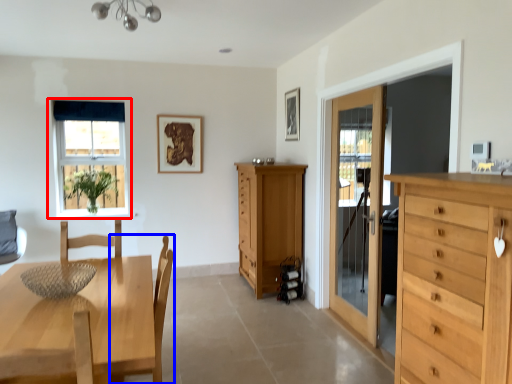
Question: Which point is closer to the camera, window (highlighted by a red box) or chair (highlighted by a blue box)?

Choices:
 (A) window
 (B) chair

Answer: (B)